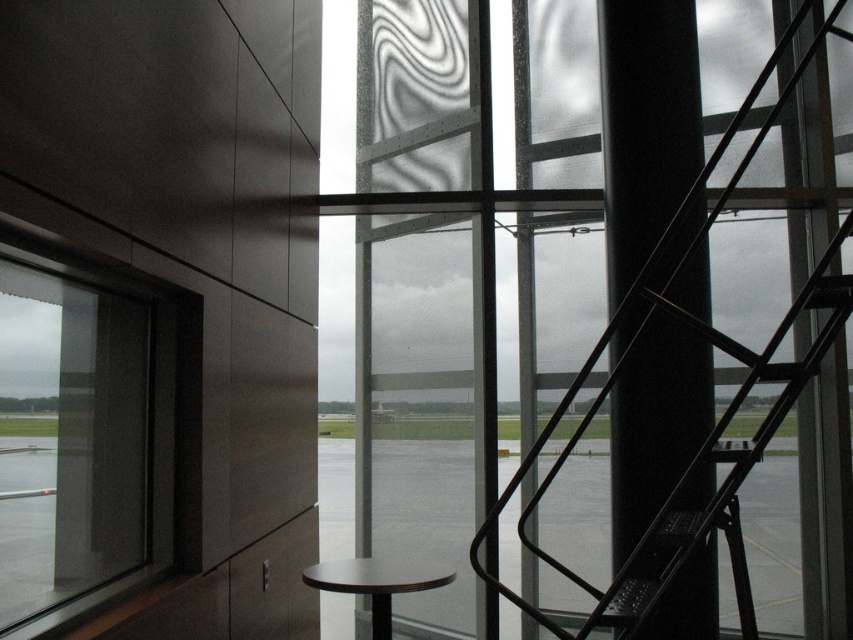
You are standing at the center of the airport terminal and want to climb the metallic black ladder at right to clean the window. Can you reach the ladder without moving from your current position?

The distance between you and the metallic black ladder at right is 3.17 meters, so you can reach it without moving from your current position if your reach extends that far. However, typically, a person cannot reach 3.17 meters without moving, so you would need to step closer.

You are a maintenance worker needing to reach the transparent glass window at left to clean it. You have a 1.0 meter long extension pole. If you are standing on the matte black stool at lower center, will the pole allow you to reach the window?

The distance between the transparent glass window at left and the matte black stool at lower center is 1.07 meters. Since the pole is only 1.0 meters long, it is 7 centimeters shorter than needed. Therefore, the pole will not be long enough to reach the window from the stool.

You are standing in an airport terminal and want to check the weather outside by looking through the transparent glass window at left. Considering your height is 5 feet 8 inches, can you comfortably see over the window sill?

The distance between you and the transparent glass window at left is 6.15 feet. Since the window is at your left and you are 5 feet 8 inches tall, you can comfortably see over the window sill as the distance allows for proper visibility.